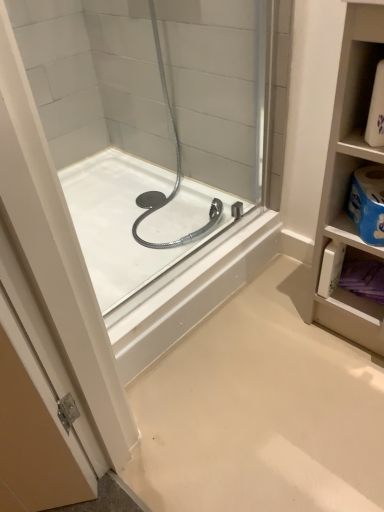
Question: Would you say white plastic shelf at upper right is to the left or to the right of white glossy bathtub at center in the picture?

Choices:
 (A) right
 (B) left

Answer: (A)

Question: Would you say white plastic shelf at upper right is inside or outside white glossy bathtub at center?

Choices:
 (A) outside
 (B) inside

Answer: (A)

Question: Is white plastic shelf at upper right in front of or behind white glossy bathtub at center in the image?

Choices:
 (A) behind
 (B) front

Answer: (B)

Question: Considering their positions, is white glossy bathtub at center located in front of or behind white plastic shelf at upper right?

Choices:
 (A) front
 (B) behind

Answer: (B)

Question: Looking at their shapes, would you say white glossy bathtub at center is wider or thinner than white plastic shelf at upper right?

Choices:
 (A) wide
 (B) thin

Answer: (A)

Question: Is white glossy bathtub at center bigger or smaller than white plastic shelf at upper right?

Choices:
 (A) small
 (B) big

Answer: (B)

Question: Is point (107, 173) positioned closer to the camera than point (362, 98)?

Choices:
 (A) farther
 (B) closer

Answer: (A)